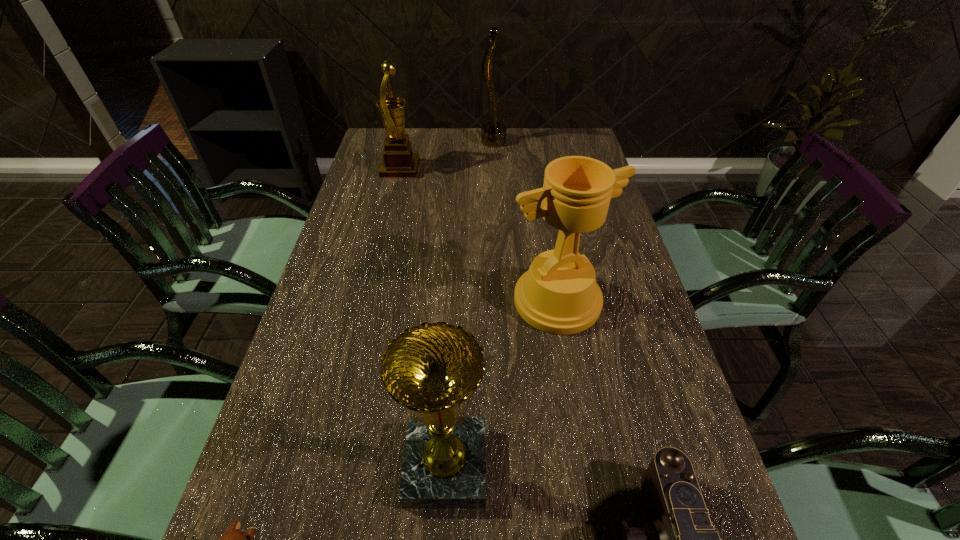
You are a GUI agent. You are given a task and a screenshot of the screen. Output one action in this format:
    pyautogui.click(x=<x>, y=<y>)
    Task: Click on the object that is at the left edge
    This screenshot has height=540, width=960.
    Given the screenshot: What is the action you would take?
    pyautogui.click(x=399, y=161)

The width and height of the screenshot is (960, 540). I want to click on object that is at the right edge, so click(559, 295).

Locate an element on the screen. The width and height of the screenshot is (960, 540). object present at the far left corner is located at coordinates (399, 161).

Find the location of `free space at the far edge of the desktop`. free space at the far edge of the desktop is located at coordinates (476, 143).

Where is `free region at the left edge`? free region at the left edge is located at coordinates (357, 368).

Where is `free space at the right edge of the desktop`? Image resolution: width=960 pixels, height=540 pixels. free space at the right edge of the desktop is located at coordinates (642, 475).

Find the location of a particular element. The height and width of the screenshot is (540, 960). vacant space at the far left corner is located at coordinates (407, 129).

I want to click on free space at the far right corner of the desktop, so click(x=573, y=155).

Identify the location of vacant area that lies between the nearest award and the second nearest award. (502, 383).

Locate an element on the screen. This screenshot has height=540, width=960. free area in between the leftmost award and the farthest object is located at coordinates (447, 156).